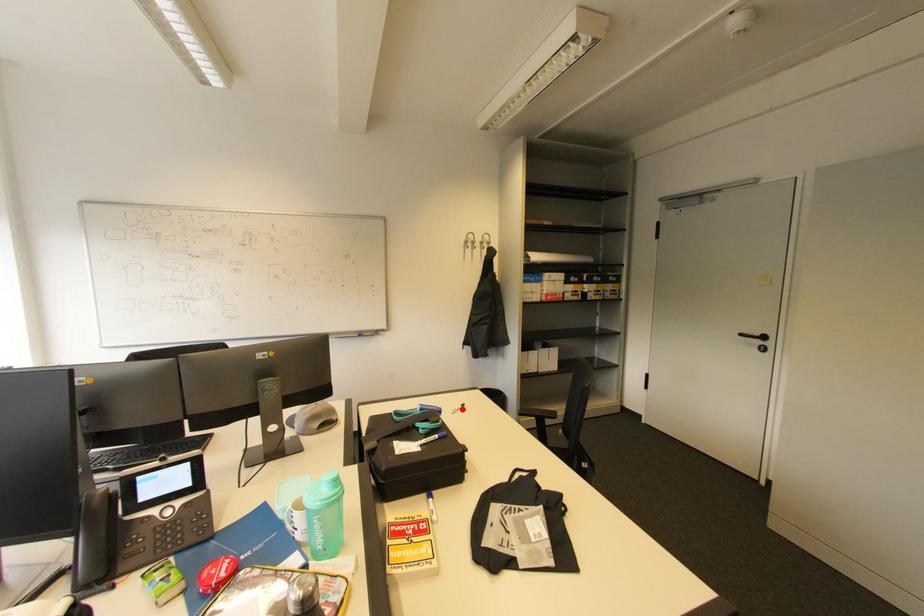
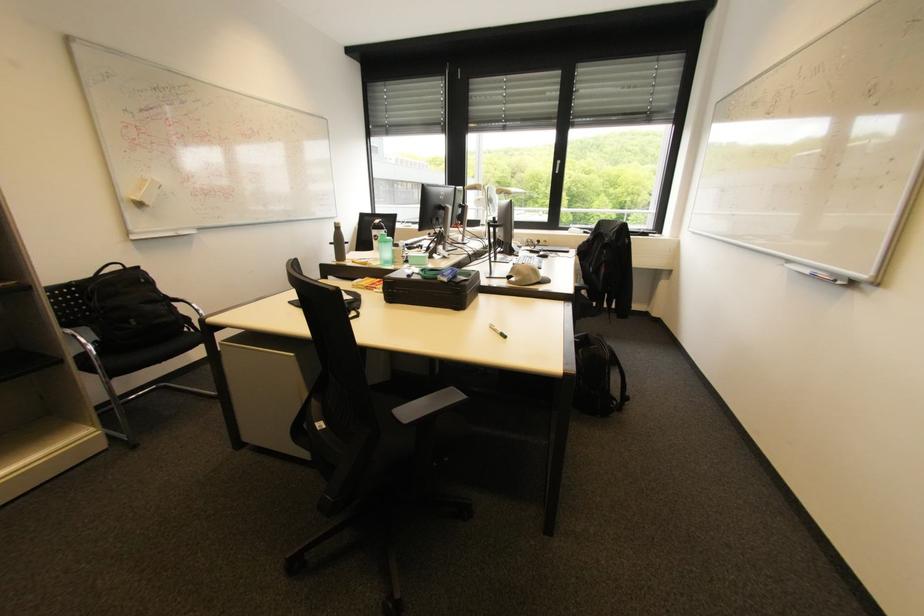
Find the pixel in the second image that matches the highlighted location in the first image.

(501, 329)